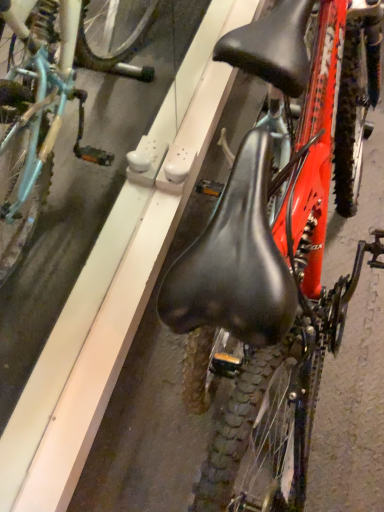
Where is `metallic gray curb at center`? The width and height of the screenshot is (384, 512). metallic gray curb at center is located at coordinates (113, 290).

This screenshot has height=512, width=384. What do you see at coordinates (113, 290) in the screenshot?
I see `metallic gray curb at center` at bounding box center [113, 290].

You are a GUI agent. You are given a task and a screenshot of the screen. Output one action in this format:
    pyautogui.click(x=<x>, y=<y>)
    Task: Click on the metallic gray curb at center
    Image resolution: width=384 pixels, height=512 pixels.
    Given the screenshot: What is the action you would take?
    pyautogui.click(x=113, y=290)